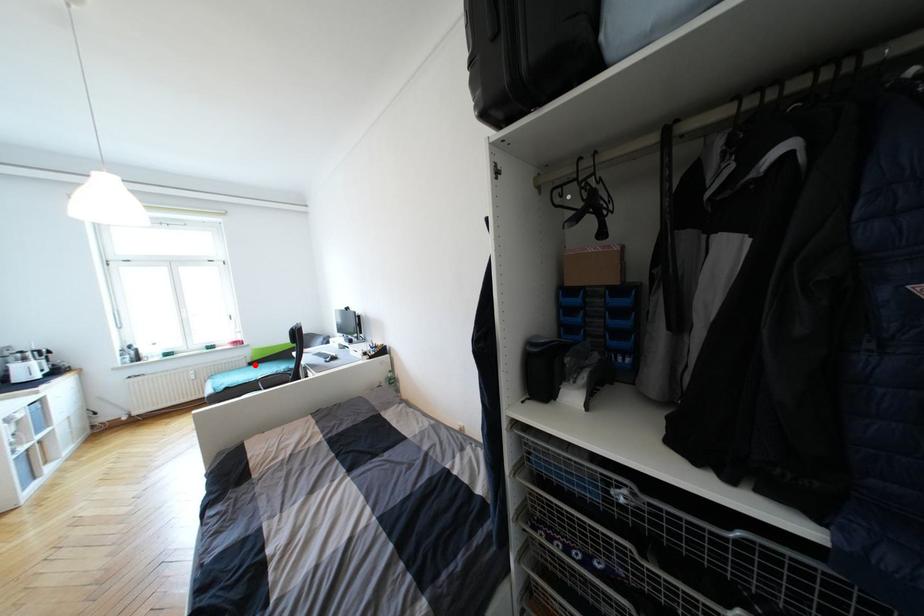
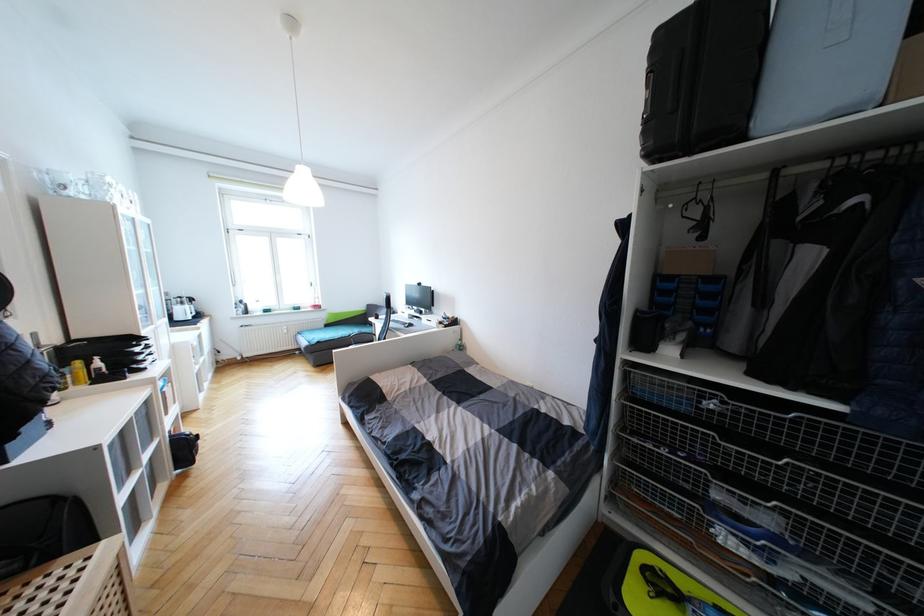
Question: I am providing you with two images of the same scene from different viewpoints. A red point is shown in image1. For the corresponding object point in image2, is it positioned nearer or farther from the camera?

Choices:
 (A) Nearer
 (B) Farther

Answer: (A)